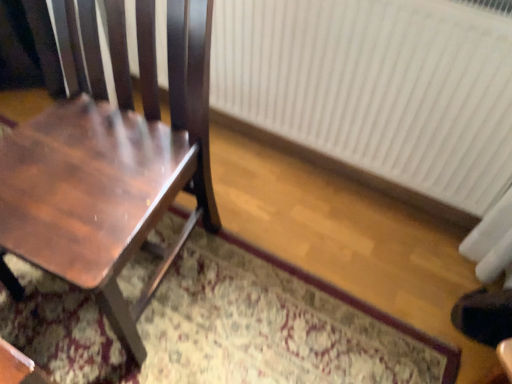
Find the location of a particular element. shiny brown wood chair at left is located at coordinates (112, 156).

This screenshot has height=384, width=512. What do you see at coordinates (223, 327) in the screenshot?
I see `patterned carpet at center` at bounding box center [223, 327].

Looking at this image, measure the distance between point (x=297, y=311) and camera.

The distance of point (x=297, y=311) from camera is 4.12 feet.

I want to click on shiny brown wood chair at left, so click(112, 156).

From a real-world perspective, is white plastic radiator at right under patterned carpet at center?

No, from a real-world perspective, white plastic radiator at right is not beneath patterned carpet at center.

Considering the relative sizes of white plastic radiator at right and patterned carpet at center in the image provided, is white plastic radiator at right wider than patterned carpet at center?

In fact, white plastic radiator at right might be narrower than patterned carpet at center.

Who is bigger, white plastic radiator at right or patterned carpet at center?

With larger size is patterned carpet at center.

Relative to patterned carpet at center, is white plastic radiator at right in front or behind?

Visually, white plastic radiator at right is located behind patterned carpet at center.

Considering the relative sizes of white plastic radiator at right and shiny brown wood chair at left in the image provided, is white plastic radiator at right wider than shiny brown wood chair at left?

No, white plastic radiator at right is not wider than shiny brown wood chair at left.

This screenshot has height=384, width=512. I want to click on radiator that is above the shiny brown wood chair at left (from the image's perspective), so click(377, 87).

Consider the image. Can you confirm if white plastic radiator at right is smaller than shiny brown wood chair at left?

Yes.

Can you tell me how much white plastic radiator at right and shiny brown wood chair at left differ in facing direction?

white plastic radiator at right and shiny brown wood chair at left are facing 2.25 degrees away from each other.

Is shiny brown wood chair at left spatially inside patterned carpet at center, or outside of it?

shiny brown wood chair at left is located beyond the bounds of patterned carpet at center.

From a real-world perspective, is shiny brown wood chair at left above or below patterned carpet at center?

Clearly, from a real-world perspective, shiny brown wood chair at left is above patterned carpet at center.

Is shiny brown wood chair at left bigger or smaller than patterned carpet at center?

Clearly, shiny brown wood chair at left is larger in size than patterned carpet at center.

I want to click on radiator lying on the right of patterned carpet at center, so click(x=377, y=87).

Between patterned carpet at center and white plastic radiator at right, which one appears on the right side from the viewer's perspective?

From the viewer's perspective, white plastic radiator at right appears more on the right side.

Does patterned carpet at center lie in front of white plastic radiator at right?

Yes, patterned carpet at center is closer to the viewer.

How distant is patterned carpet at center from white plastic radiator at right?

patterned carpet at center is 23.72 inches away from white plastic radiator at right.

Considering the relative sizes of shiny brown wood chair at left and white plastic radiator at right in the image provided, is shiny brown wood chair at left thinner than white plastic radiator at right?

In fact, shiny brown wood chair at left might be wider than white plastic radiator at right.

Which of these two, shiny brown wood chair at left or white plastic radiator at right, is smaller?

white plastic radiator at right is smaller.

Is the surface of shiny brown wood chair at left in direct contact with white plastic radiator at right?

No, shiny brown wood chair at left is not making contact with white plastic radiator at right.

Considering the positions of objects shiny brown wood chair at left and white plastic radiator at right in the image provided, who is in front, shiny brown wood chair at left or white plastic radiator at right?

shiny brown wood chair at left is closer to the camera.

Does point (165, 297) lie behind point (25, 157)?

Yes, it is behind point (25, 157).

In order to click on chair above the patterned carpet at center (from a real-world perspective) in this screenshot , I will do `click(112, 156)`.

Considering the positions of objects patterned carpet at center and shiny brown wood chair at left in the image provided, who is more to the right, patterned carpet at center or shiny brown wood chair at left?

patterned carpet at center.

Is patterned carpet at center positioned before shiny brown wood chair at left?

No, patterned carpet at center is further to the viewer.

Locate an element on the screen. The width and height of the screenshot is (512, 384). radiator behind the patterned carpet at center is located at coordinates (377, 87).

Where is `chair on the left of white plastic radiator at right`? This screenshot has width=512, height=384. chair on the left of white plastic radiator at right is located at coordinates (112, 156).

Looking at the image, which one is located closer to shiny brown wood chair at left, patterned carpet at center or white plastic radiator at right?

The object closer to shiny brown wood chair at left is patterned carpet at center.

From the image, which object appears to be nearer to patterned carpet at center, white plastic radiator at right or shiny brown wood chair at left?

Based on the image, shiny brown wood chair at left appears to be nearer to patterned carpet at center.

Based on their spatial positions, is white plastic radiator at right or patterned carpet at center closer to shiny brown wood chair at left?

patterned carpet at center.

Estimate the real-world distances between objects in this image. Which object is further from white plastic radiator at right, patterned carpet at center or shiny brown wood chair at left?

patterned carpet at center is further to white plastic radiator at right.

From the picture: Considering their positions, is shiny brown wood chair at left positioned further to patterned carpet at center than white plastic radiator at right?

The object further to patterned carpet at center is white plastic radiator at right.

Looking at the image, which one is located closer to white plastic radiator at right, shiny brown wood chair at left or patterned carpet at center?

Based on the image, shiny brown wood chair at left appears to be nearer to white plastic radiator at right.

At what (x,y) coordinates should I click in order to perform the action: click on doormat between shiny brown wood chair at left and white plastic radiator at right. Please return your answer as a coordinate pair (x, y). Looking at the image, I should click on (223, 327).